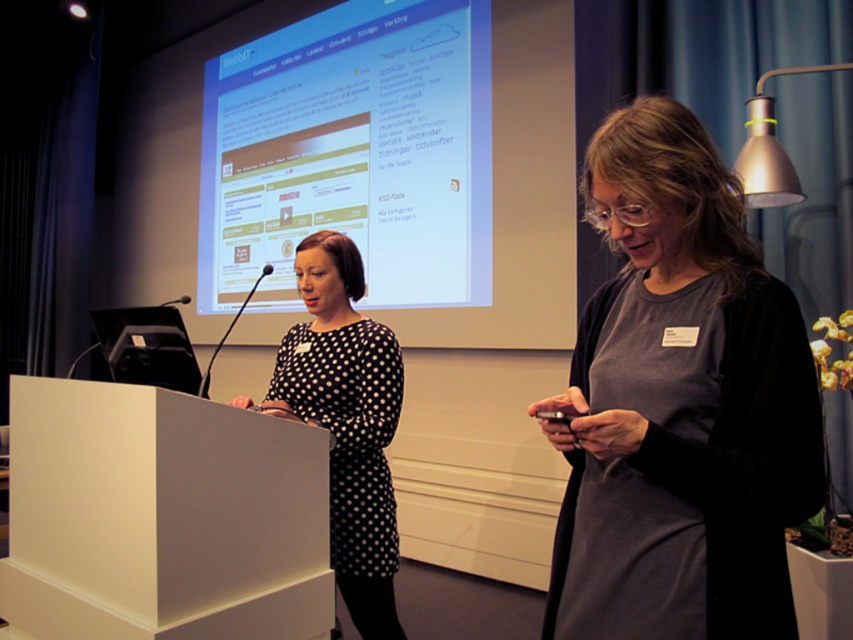
Can you confirm if white matte podium at lower left is wider than black dotted dress at center?

Correct, the width of white matte podium at lower left exceeds that of black dotted dress at center.

Who is more distant from viewer, (x=0, y=564) or (x=318, y=381)?

The point (x=318, y=381) is more distant.

Image resolution: width=853 pixels, height=640 pixels. Identify the location of white matte podium at lower left. (161, 516).

Is point (799, 476) less distant than point (351, 388)?

That is True.

Between point (747, 273) and point (310, 253), which one is positioned in front?

Point (747, 273) is in front.

The image size is (853, 640). I want to click on gray matte dress at right, so click(683, 403).

Identify the location of gray matte dress at right. This screenshot has width=853, height=640. (683, 403).

Is white glossy projection screen at upper center smaller than black dotted dress at center?

Incorrect, white glossy projection screen at upper center is not smaller in size than black dotted dress at center.

Is white glossy projection screen at upper center below black dotted dress at center?

No, white glossy projection screen at upper center is not below black dotted dress at center.

Describe the element at coordinates (352, 154) in the screenshot. I see `white glossy projection screen at upper center` at that location.

Locate an element on the screen. The image size is (853, 640). white glossy projection screen at upper center is located at coordinates (352, 154).